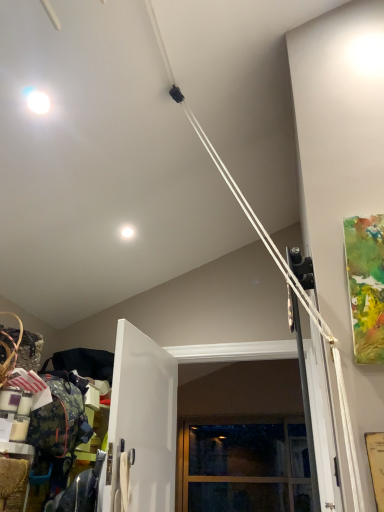
Question: Considering the relative positions of white glossy door at center and white glossy droplight at upper center in the image provided, is white glossy door at center to the right of white glossy droplight at upper center from the viewer's perspective?

Choices:
 (A) yes
 (B) no

Answer: (A)

Question: Does white glossy door at center have a greater width compared to white glossy droplight at upper center?

Choices:
 (A) yes
 (B) no

Answer: (B)

Question: Can you confirm if white glossy door at center is taller than white glossy droplight at upper center?

Choices:
 (A) no
 (B) yes

Answer: (B)

Question: Is white glossy door at center further to the viewer compared to white glossy droplight at upper center?

Choices:
 (A) no
 (B) yes

Answer: (A)

Question: Is white glossy door at center far from white glossy droplight at upper center?

Choices:
 (A) no
 (B) yes

Answer: (A)

Question: Considering the positions of point (127, 226) and point (208, 465), is point (127, 226) closer or farther from the camera than point (208, 465)?

Choices:
 (A) farther
 (B) closer

Answer: (B)

Question: Looking at the image, does white glossy droplight at upper center seem bigger or smaller compared to clear glass window at center?

Choices:
 (A) small
 (B) big

Answer: (A)

Question: From the image's perspective, is white glossy droplight at upper center located above or below clear glass window at center?

Choices:
 (A) above
 (B) below

Answer: (A)

Question: Looking at their shapes, would you say white glossy droplight at upper center is wider or thinner than clear glass window at center?

Choices:
 (A) wide
 (B) thin

Answer: (B)

Question: From the image's perspective, is white glossy droplight at upper center located above or below white glossy door at center?

Choices:
 (A) above
 (B) below

Answer: (A)

Question: Considering the positions of point (120, 229) and point (162, 355), is point (120, 229) closer or farther from the camera than point (162, 355)?

Choices:
 (A) closer
 (B) farther

Answer: (A)

Question: From a real-world perspective, relative to white glossy door at center, is white glossy droplight at upper center vertically above or below?

Choices:
 (A) below
 (B) above

Answer: (B)

Question: Considering the positions of white glossy droplight at upper center and white glossy door at center in the image, is white glossy droplight at upper center taller or shorter than white glossy door at center?

Choices:
 (A) tall
 (B) short

Answer: (B)

Question: Visually, is clear glass window at center positioned to the left or to the right of white glossy droplight at upper center?

Choices:
 (A) left
 (B) right

Answer: (B)

Question: From a real-world perspective, relative to white glossy droplight at upper center, is clear glass window at center vertically above or below?

Choices:
 (A) below
 (B) above

Answer: (A)